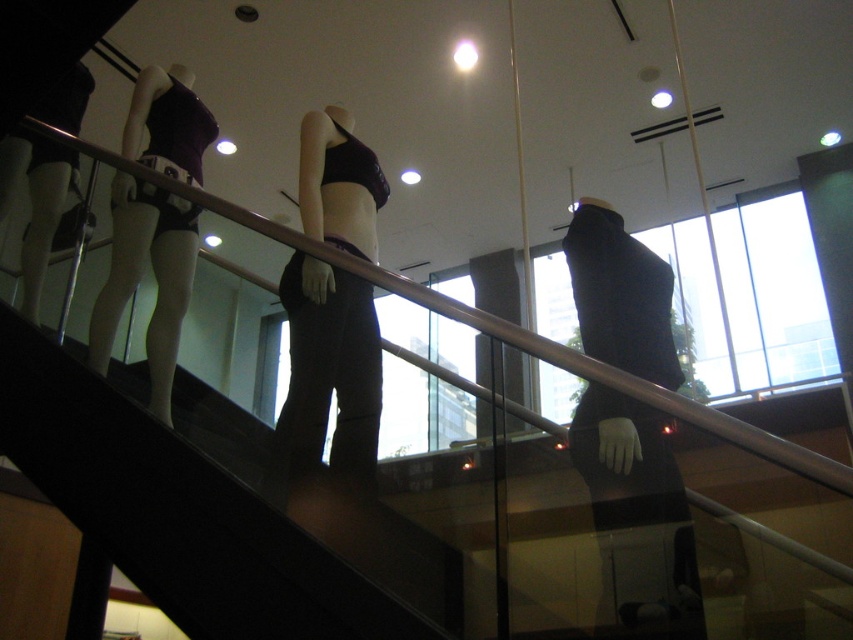
You are standing at the entrance of the staircase and want to reach the upper level where the mannequins are displayed. According to the image, where exactly are the smooth black stairs at center located?

A: The smooth black stairs at center are located at point (175, 512).

You are a customer in a clothing store and see the matte black leggings at center and the matte black underwear at left. Which item is closer to you?

The matte black leggings at center is closer to you because it is in front of the matte black underwear at left.